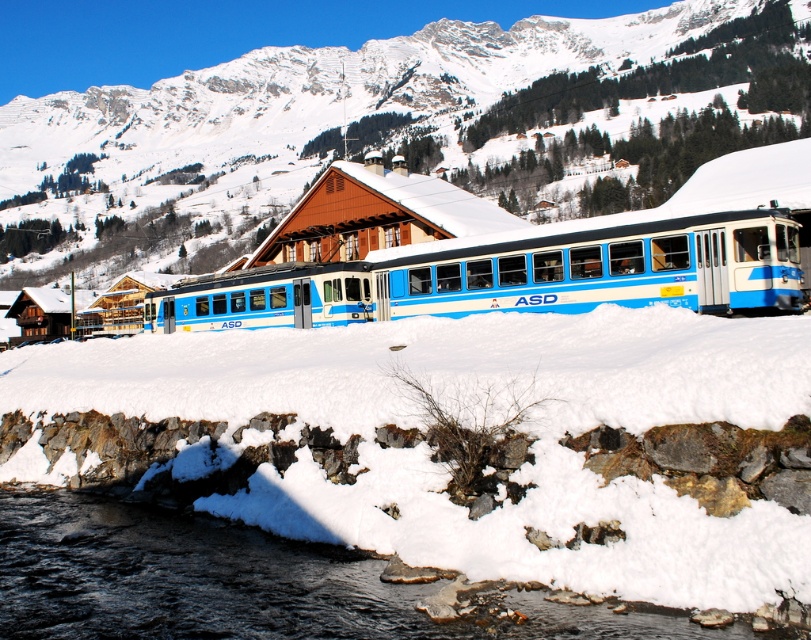
Question: Which point is farther from the camera taking this photo?

Choices:
 (A) (797, 243)
 (B) (22, 532)

Answer: (A)

Question: Which point is farther to the camera?

Choices:
 (A) blue painted metal train at center
 (B) snowy mountain at upper center

Answer: (B)

Question: Is snowy mountain at upper center below black water at lower left?

Choices:
 (A) no
 (B) yes

Answer: (A)

Question: Does snowy mountain at upper center have a lesser width compared to blue painted metal train at center?

Choices:
 (A) no
 (B) yes

Answer: (A)

Question: Which object is the closest to the blue painted metal train at center?

Choices:
 (A) snowy mountain at upper center
 (B) black water at lower left

Answer: (B)

Question: Where is snowy mountain at upper center located in relation to blue painted metal train at center in the image?

Choices:
 (A) right
 (B) left

Answer: (B)